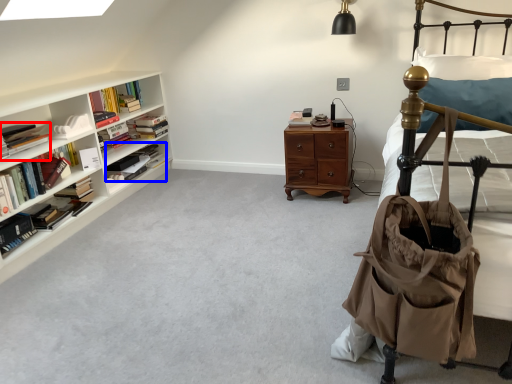
Question: Which object is further to the camera taking this photo, book (highlighted by a red box) or book (highlighted by a blue box)?

Choices:
 (A) book
 (B) book

Answer: (B)